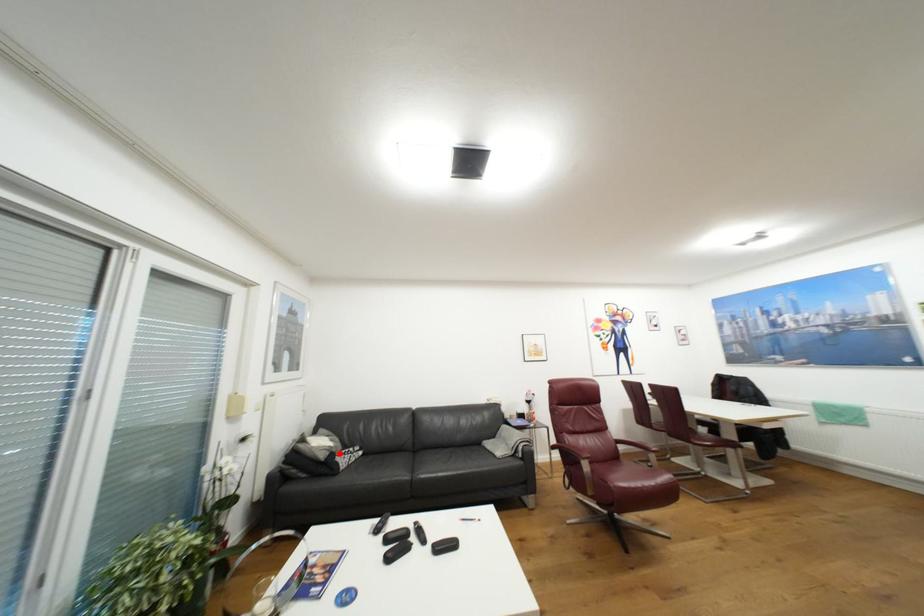
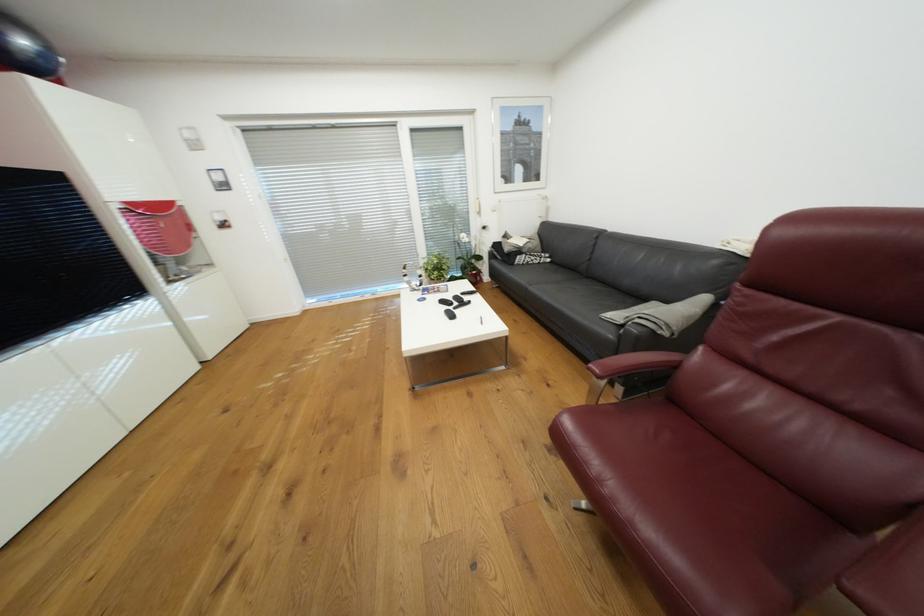
Question: I am providing you with two images of the same scene from different viewpoints. A red point is shown in image1. For the corresponding object point in image2, is it positioned nearer or farther from the camera?

Choices:
 (A) Nearer
 (B) Farther

Answer: (A)